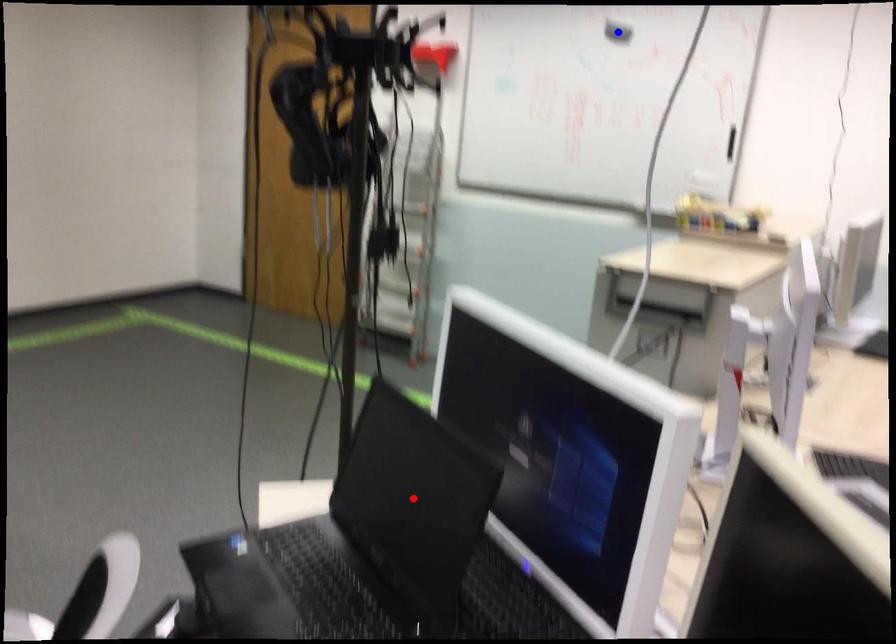
Question: In the image, two points are highlighted. Which point is nearer to the camera? Reply with the corresponding letter.

Choices:
 (A) blue point
 (B) red point

Answer: (B)